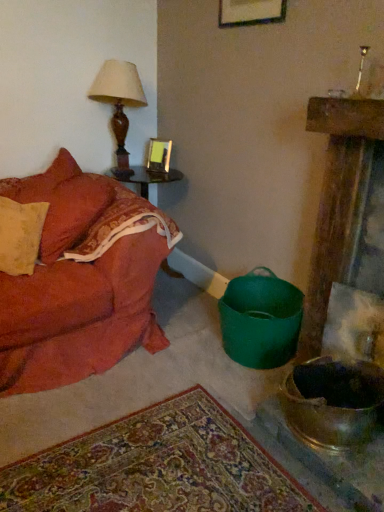
Question: Should I look upward or downward to see matte brown table lamp at upper left?

Choices:
 (A) down
 (B) up

Answer: (B)

Question: Does shiny metallic mixing bowl at lower right have a lesser width compared to matte brown table lamp at upper left?

Choices:
 (A) no
 (B) yes

Answer: (A)

Question: Is shiny metallic mixing bowl at lower right positioned far away from matte brown table lamp at upper left?

Choices:
 (A) no
 (B) yes

Answer: (B)

Question: Considering the relative positions of shiny metallic mixing bowl at lower right and matte brown table lamp at upper left in the image provided, is shiny metallic mixing bowl at lower right in front of matte brown table lamp at upper left?

Choices:
 (A) yes
 (B) no

Answer: (A)

Question: Is shiny metallic mixing bowl at lower right taller than matte brown table lamp at upper left?

Choices:
 (A) no
 (B) yes

Answer: (A)

Question: Does shiny metallic mixing bowl at lower right turn towards matte brown table lamp at upper left?

Choices:
 (A) yes
 (B) no

Answer: (B)

Question: Does shiny metallic mixing bowl at lower right appear on the right side of matte brown table lamp at upper left?

Choices:
 (A) no
 (B) yes

Answer: (B)

Question: Is wooden round table at left further to the viewer compared to velvet orange couch at left?

Choices:
 (A) no
 (B) yes

Answer: (B)

Question: From the image's perspective, is wooden round table at left located above velvet orange couch at left?

Choices:
 (A) yes
 (B) no

Answer: (A)

Question: Is velvet orange couch at left a part of wooden round table at left?

Choices:
 (A) no
 (B) yes

Answer: (A)

Question: Considering the relative sizes of wooden round table at left and velvet orange couch at left in the image provided, is wooden round table at left bigger than velvet orange couch at left?

Choices:
 (A) yes
 (B) no

Answer: (B)

Question: Can you confirm if wooden round table at left is smaller than velvet orange couch at left?

Choices:
 (A) yes
 (B) no

Answer: (A)

Question: Is velvet orange couch at left at the back of wooden round table at left?

Choices:
 (A) yes
 (B) no

Answer: (B)

Question: Can you confirm if matte glass picture frame at upper center is shorter than velvet orange couch at left?

Choices:
 (A) no
 (B) yes

Answer: (B)